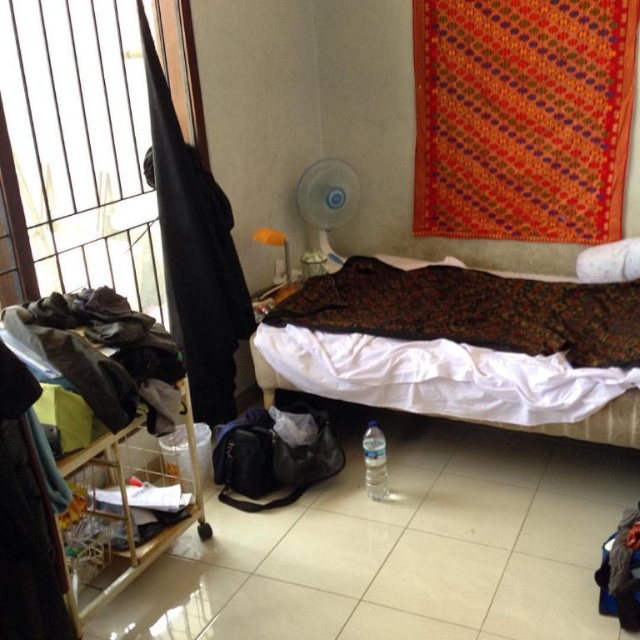
You are standing in the room and want to place a new painting on the wall behind the patterned fabric bed at center. Is there enough space behind the bed to hang the painting without overlapping the white soft pillow at upper right?

The patterned fabric bed at center is in front of the white soft pillow at upper right, meaning the pillow is already positioned behind the bed. Therefore, there is no additional space behind the bed to hang a new painting without overlapping the existing pillow.

You are standing in the room and want to place a small lamp on the white soft pillow at upper right. Can you do this without moving the patterned fabric bed at center?

The patterned fabric bed at center is located below the white soft pillow at upper right, so you can place the lamp on the pillow without moving the bed since they are in different vertical positions.

You are standing in the room and want to hang a new picture frame between the red woven cloth at upper right and the black fabric at left. Based on their positions, which side should you place the frame closer to?

The red woven cloth at upper right is to the right of the black fabric at left, so you should place the frame closer to the black fabric at left to center it between them.